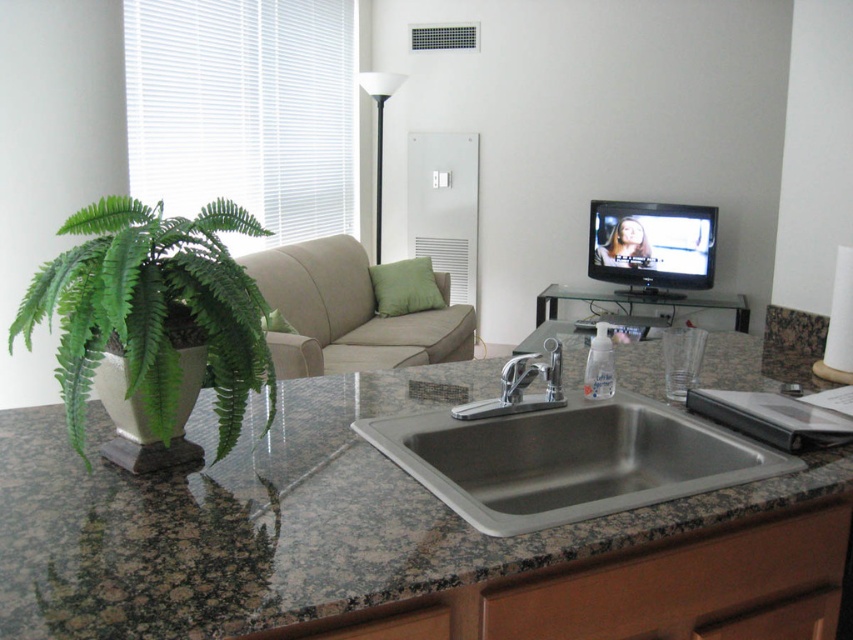
You are standing in the kitchenette and want to place a small vase on the countertop. The vase is 10 cm wide. The countertop has an available space at point (154, 310). Can you fit the vase there?

The available space at point (154, 310) is occupied by the green leafy fern at left, so the vase cannot be placed there.

Consider the image. You are standing in the kitchenette and want to place a new plant exactly where the green leafy fern at left is currently located. What are the coordinates of that spot?

The coordinates of the green leafy fern at left are at point (154, 310).

You are a guest in a hotel room and need to place a rectangular box that is 1.2 meters long. You see the granite at center and the beige fabric couch at center. Which object should you place the box next to to ensure it fits without overlapping?

The granite at center is positioned on the right side of beige fabric couch at center. Since the box is 1.2 meters long, it would be best to place it next to the beige fabric couch at center as the granite is to its right but the couch might have more space along its length.